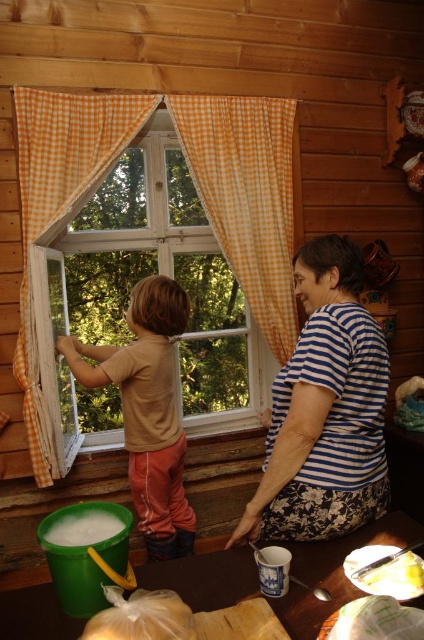
Question: Considering the real-world distances, which object is farthest from the brown cotton shirt at left?

Choices:
 (A) blue striped shirt at center
 (B) orange checkered curtain at window
 (C) orange checkered curtain at center

Answer: (A)

Question: Is blue striped shirt at center bigger than orange checkered curtain at center?

Choices:
 (A) no
 (B) yes

Answer: (A)

Question: Can you confirm if clear glass window at center is positioned below blue striped shirt at center?

Choices:
 (A) yes
 (B) no

Answer: (B)

Question: Does clear glass window at center have a greater width compared to orange checkered curtain at window?

Choices:
 (A) yes
 (B) no

Answer: (A)

Question: Which point appears farthest from the camera in this image?

Choices:
 (A) (251, 513)
 (B) (240, 310)

Answer: (B)

Question: Considering the real-world distances, which object is farthest from the orange checkered curtain at center?

Choices:
 (A) blue striped shirt at center
 (B) brown cotton shirt at left

Answer: (A)